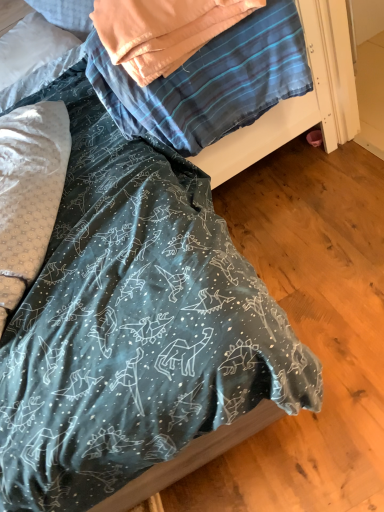
Question: Considering their positions, is teal fabric at center located in front of or behind white soft pillow at upper left, which is the 2th pillow in bottom-to-top order?

Choices:
 (A) behind
 (B) front

Answer: (B)

Question: Is teal fabric at center wider or thinner than white soft pillow at upper left, the 1th pillow in the back-to-front sequence?

Choices:
 (A) thin
 (B) wide

Answer: (B)

Question: Which object is the farthest from the white soft pillow at upper left, the second pillow when ordered from front to back?

Choices:
 (A) teal fabric at center
 (B) white dotted fabric pillow at left, which appears as the 1th pillow when ordered from the bottom

Answer: (A)

Question: Based on their relative distances, which object is nearer to the teal fabric at center?

Choices:
 (A) white soft pillow at upper left, the second pillow when ordered from front to back
 (B) white dotted fabric pillow at left, which appears as the second pillow when viewed from the back

Answer: (B)